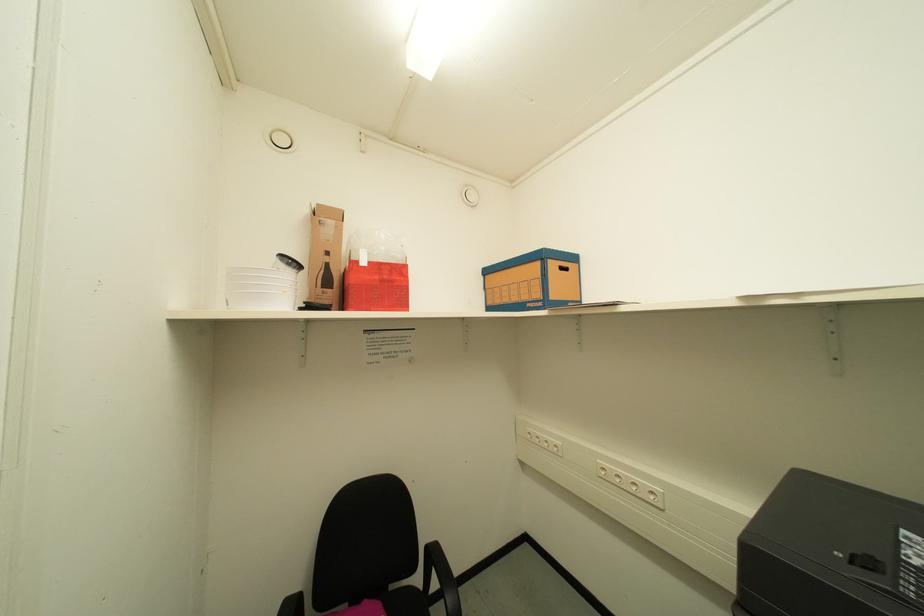
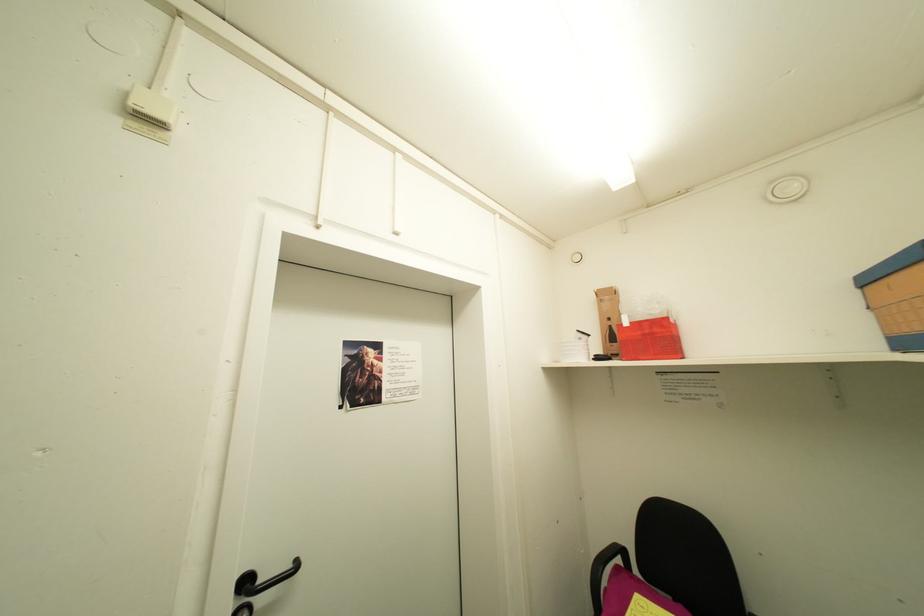
Question: How did the camera likely rotate?

Choices:
 (A) Left
 (B) Right
 (C) Up
 (D) Down

Answer: (A)